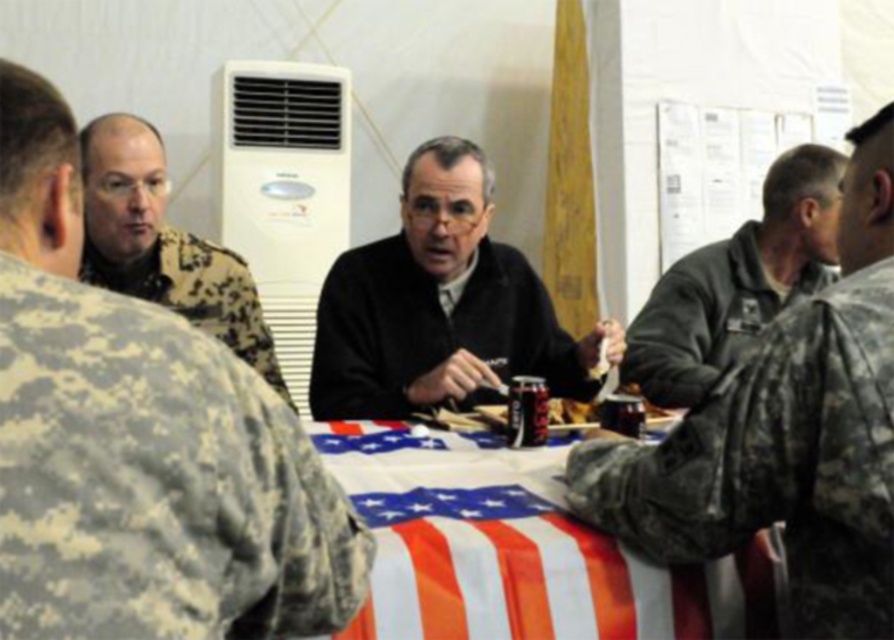
Question: Does american flag tablecloth at center appear under white plastic air conditioner at upper center?

Choices:
 (A) no
 (B) yes

Answer: (B)

Question: Which object is closer to the camera taking this photo?

Choices:
 (A) camouflage fabric uniform at left
 (B) camouflage uniform at left
 (C) american flag tablecloth at center

Answer: (A)

Question: Is dark gray fleece jacket at right thinner than black matte jacket at center?

Choices:
 (A) yes
 (B) no

Answer: (A)

Question: Among these objects, which one is farthest from the camera?

Choices:
 (A) white plastic air conditioner at upper center
 (B) camouflage uniform at left
 (C) dark gray fleece jacket at right

Answer: (A)

Question: In this image, where is camouflage fabric uniform at left located relative to gray matte jacket at right?

Choices:
 (A) below
 (B) above

Answer: (A)

Question: Which point appears farthest from the camera in this image?

Choices:
 (A) (302, 326)
 (B) (232, 534)
 (C) (470, 515)
 (D) (85, 150)

Answer: (A)